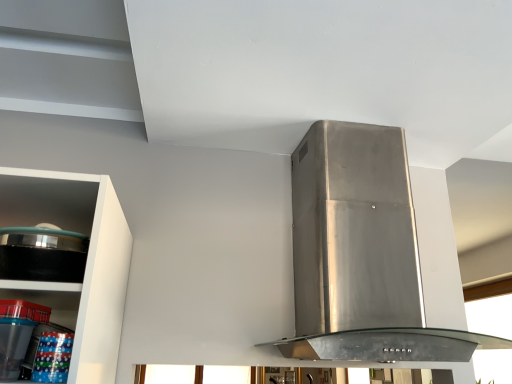
The width and height of the screenshot is (512, 384). Describe the element at coordinates (42, 254) in the screenshot. I see `black glossy pot at left` at that location.

Locate an element on the screen. clear plastic containers at lower left is located at coordinates (47, 298).

Describe the element at coordinates (490, 316) in the screenshot. I see `transparent glass window at upper right` at that location.

Measure the distance between transparent glass window at upper right and camera.

The distance of transparent glass window at upper right from camera is 12.09 feet.

Where is `black glossy pot at left`? black glossy pot at left is located at coordinates (42, 254).

Is clear plastic containers at lower left positioned with its back to transparent glass window at upper right?

No, clear plastic containers at lower left is not facing the opposite direction of transparent glass window at upper right.

Based on their positions, is clear plastic containers at lower left located to the left or right of transparent glass window at upper right?

Based on their positions, clear plastic containers at lower left is located to the left of transparent glass window at upper right.

In the scene shown: Can you confirm if clear plastic containers at lower left is bigger than transparent glass window at upper right?

No, clear plastic containers at lower left is not bigger than transparent glass window at upper right.

How many degrees apart are the facing directions of clear plastic containers at lower left and transparent glass window at upper right?

The angle between the facing direction of clear plastic containers at lower left and the facing direction of transparent glass window at upper right is 90.4 degrees.

Find the location of a particular element. shelf lying behind the black glossy pot at left is located at coordinates (47, 298).

Is black glossy pot at left aimed at clear plastic containers at lower left?

No, black glossy pot at left is not aimed at clear plastic containers at lower left.

Consider the image. Is clear plastic containers at lower left inside black glossy pot at left?

Actually, clear plastic containers at lower left is outside black glossy pot at left.

Is point (42, 236) positioned before point (49, 286)?

No, it is behind (49, 286).

Would you say stainless steel range hood at center is inside or outside clear plastic containers at lower left?

stainless steel range hood at center is located beyond the bounds of clear plastic containers at lower left.

Based on the photo, how many degrees apart are the facing directions of stainless steel range hood at center and clear plastic containers at lower left?

0.254 degrees.

Identify the location of shelf below the stainless steel range hood at center (from a real-world perspective). This screenshot has height=384, width=512. (47, 298).

In the scene shown: In the image, is stainless steel range hood at center positioned in front of or behind clear plastic containers at lower left?

In the image, stainless steel range hood at center appears behind clear plastic containers at lower left.

Considering the sizes of objects clear plastic containers at lower left and stainless steel range hood at center in the image provided, who is thinner, clear plastic containers at lower left or stainless steel range hood at center?

clear plastic containers at lower left is thinner.

In the image, is clear plastic containers at lower left positioned in front of or behind stainless steel range hood at center?

clear plastic containers at lower left is positioned closer to the viewer than stainless steel range hood at center.

Considering the relative positions of clear plastic containers at lower left and stainless steel range hood at center in the image provided, is clear plastic containers at lower left to the left or to the right of stainless steel range hood at center?

Clearly, clear plastic containers at lower left is on the left of stainless steel range hood at center in the image.

Is point (80, 288) closer to viewer compared to point (317, 251)?

That is True.

Which is closer to the camera, (x=467, y=316) or (x=466, y=361)?

Point (x=467, y=316) is farther from the camera than point (x=466, y=361).

Which of these two, transparent glass window at upper right or stainless steel range hood at center, is thinner?

Result: transparent glass window at upper right is thinner.

Based on their sizes in the image, would you say transparent glass window at upper right is bigger or smaller than stainless steel range hood at center?

Clearly, transparent glass window at upper right is smaller in size than stainless steel range hood at center.

From the picture: From a real-world perspective, is transparent glass window at upper right below stainless steel range hood at center?

Yes, from a real-world perspective, transparent glass window at upper right is beneath stainless steel range hood at center.

Is clear plastic containers at lower left facing away from black glossy pot at left?

No.

Measure the distance from clear plastic containers at lower left to black glossy pot at left.

clear plastic containers at lower left and black glossy pot at left are 5.43 inches apart.

From the image's perspective, is clear plastic containers at lower left located beneath black glossy pot at left?

Yes.

Consider the image. In the image, is clear plastic containers at lower left on the left side or the right side of black glossy pot at left?

clear plastic containers at lower left is positioned on black glossy pot at left's left side.

Considering the points (497, 332) and (64, 301), which point is behind, point (497, 332) or point (64, 301)?

The point (497, 332) is farther from the camera.

Between transparent glass window at upper right and clear plastic containers at lower left, which one has less height?

clear plastic containers at lower left.

From a real-world perspective, is transparent glass window at upper right on top of clear plastic containers at lower left?

Yes, from a real-world perspective, transparent glass window at upper right is on top of clear plastic containers at lower left.

From the image's perspective, which one is positioned lower, transparent glass window at upper right or clear plastic containers at lower left?

From the image's view, transparent glass window at upper right is below.

This screenshot has height=384, width=512. Identify the location of shelf lying in front of the transparent glass window at upper right. (47, 298).

You are a GUI agent. You are given a task and a screenshot of the screen. Output one action in this format:
    pyautogui.click(x=<x>, y=<y>)
    Task: Click on the appliance above the clear plastic containers at lower left (from the image's perspective)
    This screenshot has width=512, height=384.
    Given the screenshot: What is the action you would take?
    pyautogui.click(x=42, y=254)

When comparing their distances from transparent glass window at upper right, does stainless steel range hood at center or clear plastic containers at lower left seem closer?

stainless steel range hood at center is closer to transparent glass window at upper right.

Based on their spatial positions, is black glossy pot at left or stainless steel range hood at center closer to clear plastic containers at lower left?

black glossy pot at left is closer to clear plastic containers at lower left.

Based on their spatial positions, is transparent glass window at upper right or clear plastic containers at lower left further from stainless steel range hood at center?

transparent glass window at upper right lies further to stainless steel range hood at center than the other object.

From the image, which object appears to be farther from black glossy pot at left, stainless steel range hood at center or transparent glass window at upper right?

Result: Based on the image, transparent glass window at upper right appears to be further to black glossy pot at left.

From the image, which object appears to be nearer to clear plastic containers at lower left, transparent glass window at upper right or stainless steel range hood at center?

stainless steel range hood at center is positioned closer to the anchor clear plastic containers at lower left.

Looking at the image, which one is located closer to black glossy pot at left, stainless steel range hood at center or clear plastic containers at lower left?

Based on the image, clear plastic containers at lower left appears to be nearer to black glossy pot at left.

When comparing their distances from stainless steel range hood at center, does transparent glass window at upper right or black glossy pot at left seem closer?

Among the two, black glossy pot at left is located nearer to stainless steel range hood at center.

Estimate the real-world distances between objects in this image. Which object is closer to transparent glass window at upper right, black glossy pot at left or clear plastic containers at lower left?

The object closer to transparent glass window at upper right is clear plastic containers at lower left.

Where is `appliance located between clear plastic containers at lower left and stainless steel range hood at center in the left-right direction`? appliance located between clear plastic containers at lower left and stainless steel range hood at center in the left-right direction is located at coordinates (42, 254).

At what (x,y) coordinates should I click in order to perform the action: click on appliance situated between clear plastic containers at lower left and transparent glass window at upper right from left to right. Please return your answer as a coordinate pair (x, y). Looking at the image, I should click on (42, 254).

This screenshot has height=384, width=512. I want to click on home appliance located between black glossy pot at left and transparent glass window at upper right in the depth direction, so click(361, 254).

Find the location of a particular element. Image resolution: width=512 pixels, height=384 pixels. home appliance located between clear plastic containers at lower left and transparent glass window at upper right in the depth direction is located at coordinates (361, 254).